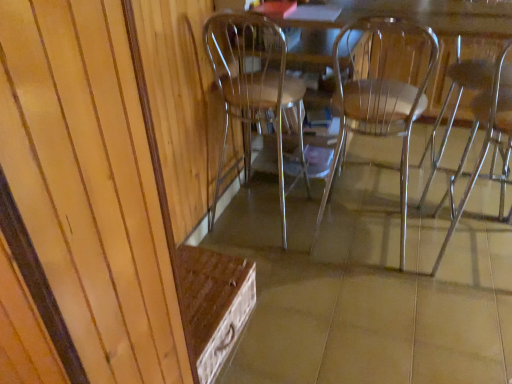
Question: Is clear plastic chair at right, positioned as the 1th chair in right-to-left order, oriented towards clear plastic chair at center, arranged as the 1th chair when viewed from the left?

Choices:
 (A) no
 (B) yes

Answer: (A)

Question: Does clear plastic chair at right, which is counted as the 4th chair, starting from the left, have a smaller size compared to clear plastic chair at center, arranged as the 1th chair when viewed from the left?

Choices:
 (A) yes
 (B) no

Answer: (A)

Question: From a real-world perspective, does clear plastic chair at right, positioned as the 1th chair in right-to-left order, sit lower than clear plastic chair at center, the fourth chair when ordered from right to left?

Choices:
 (A) yes
 (B) no

Answer: (B)

Question: From the image's perspective, is clear plastic chair at right, which is counted as the 4th chair, starting from the left, above clear plastic chair at center, the fourth chair when ordered from right to left?

Choices:
 (A) yes
 (B) no

Answer: (B)

Question: Is clear plastic chair at right, positioned as the 1th chair in right-to-left order, looking in the opposite direction of clear plastic chair at center, the fourth chair when ordered from right to left?

Choices:
 (A) no
 (B) yes

Answer: (A)

Question: Is clear plastic chair at right, positioned as the 1th chair in right-to-left order, outside clear plastic chair at center, the fourth chair when ordered from right to left?

Choices:
 (A) no
 (B) yes

Answer: (B)

Question: Considering the relative sizes of clear plastic chair at center, the fourth chair when ordered from right to left, and clear plastic chair at center, which is the second chair from left to right, in the image provided, is clear plastic chair at center, the fourth chair when ordered from right to left, smaller than clear plastic chair at center, which is the second chair from left to right,?

Choices:
 (A) yes
 (B) no

Answer: (A)

Question: Is clear plastic chair at center, the fourth chair when ordered from right to left, touching clear plastic chair at center, which is the second chair from left to right?

Choices:
 (A) no
 (B) yes

Answer: (A)

Question: Is clear plastic chair at center, arranged as the 1th chair when viewed from the left, shorter than clear plastic chair at center, which is the second chair from left to right?

Choices:
 (A) yes
 (B) no

Answer: (A)

Question: Does clear plastic chair at center, the fourth chair when ordered from right to left, have a greater width compared to clear plastic chair at center, the third chair viewed from the right?

Choices:
 (A) no
 (B) yes

Answer: (A)

Question: Can we say clear plastic chair at center, the fourth chair when ordered from right to left, lies outside clear plastic chair at center, which is the second chair from left to right?

Choices:
 (A) no
 (B) yes

Answer: (B)

Question: From a real-world perspective, is clear plastic chair at center, the fourth chair when ordered from right to left, positioned over clear plastic chair at center, which is the second chair from left to right, based on gravity?

Choices:
 (A) no
 (B) yes

Answer: (A)

Question: From the image's perspective, is clear plastic chair at right, positioned as the 1th chair in right-to-left order, above clear plastic chair at center, the third chair viewed from the right?

Choices:
 (A) no
 (B) yes

Answer: (A)